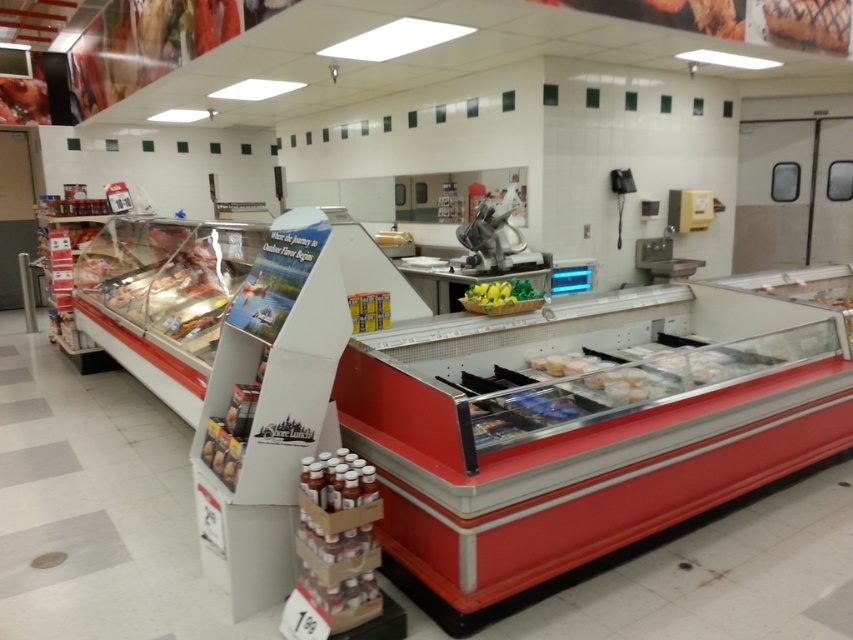
Is point (165, 220) behind point (828, 44)?

Yes, point (165, 220) is farther from viewer.

Locate an element on the screen. Image resolution: width=853 pixels, height=640 pixels. translucent plastic meat at left is located at coordinates (167, 275).

Is point (106, 252) closer to viewer compared to point (828, 17)?

No.

Where is `translucent plastic meat at left`? Image resolution: width=853 pixels, height=640 pixels. translucent plastic meat at left is located at coordinates (167, 275).

In the scene shown: Does translucent plastic meat at left have a greater height compared to yellow-green plastic basket at center?

Correct, translucent plastic meat at left is much taller as yellow-green plastic basket at center.

Can you confirm if translucent plastic meat at left is shorter than yellow-green plastic basket at center?

Incorrect, translucent plastic meat at left's height does not fall short of yellow-green plastic basket at center's.

Where is `translucent plastic meat at left`? Image resolution: width=853 pixels, height=640 pixels. translucent plastic meat at left is located at coordinates (167, 275).

Locate an element on the screen. Image resolution: width=853 pixels, height=640 pixels. translucent plastic meat at left is located at coordinates (167, 275).

Does point (467, 301) come farther from viewer compared to point (36, 109)?

That is False.

Measure the distance between yellow-green plastic basket at center and smooth glossy meat at upper left.

A distance of 26.49 feet exists between yellow-green plastic basket at center and smooth glossy meat at upper left.

Where is `yellow-green plastic basket at center`? The image size is (853, 640). yellow-green plastic basket at center is located at coordinates (502, 298).